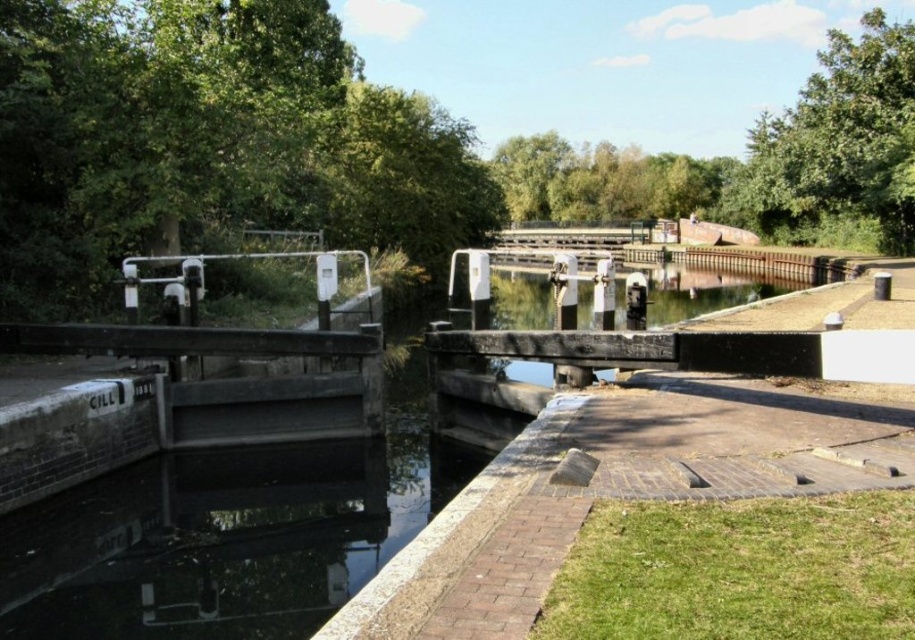
Question: Which is nearer to the green leafy tree at upper right?

Choices:
 (A) green leafy tree at upper left
 (B) green leafy tree at upper center

Answer: (B)

Question: Is green leafy tree at upper left closer to camera compared to green leafy tree at upper center?

Choices:
 (A) no
 (B) yes

Answer: (B)

Question: Does green leafy tree at upper right have a larger size compared to green leafy tree at upper center?

Choices:
 (A) no
 (B) yes

Answer: (B)

Question: Which point is closer to the camera?

Choices:
 (A) green leafy tree at upper center
 (B) green leafy tree at upper right
 (C) green leafy tree at upper left

Answer: (C)

Question: Where is green leafy tree at upper left located in relation to green leafy tree at upper right in the image?

Choices:
 (A) right
 (B) left

Answer: (B)

Question: Which point is closer to the camera?

Choices:
 (A) green leafy tree at upper center
 (B) green leafy tree at upper right
 (C) green leafy tree at upper left

Answer: (C)